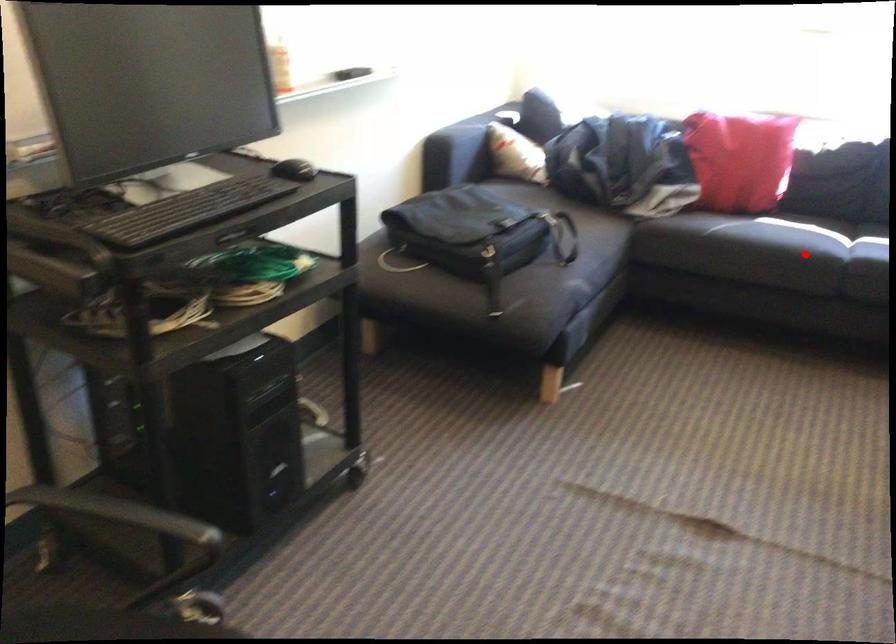
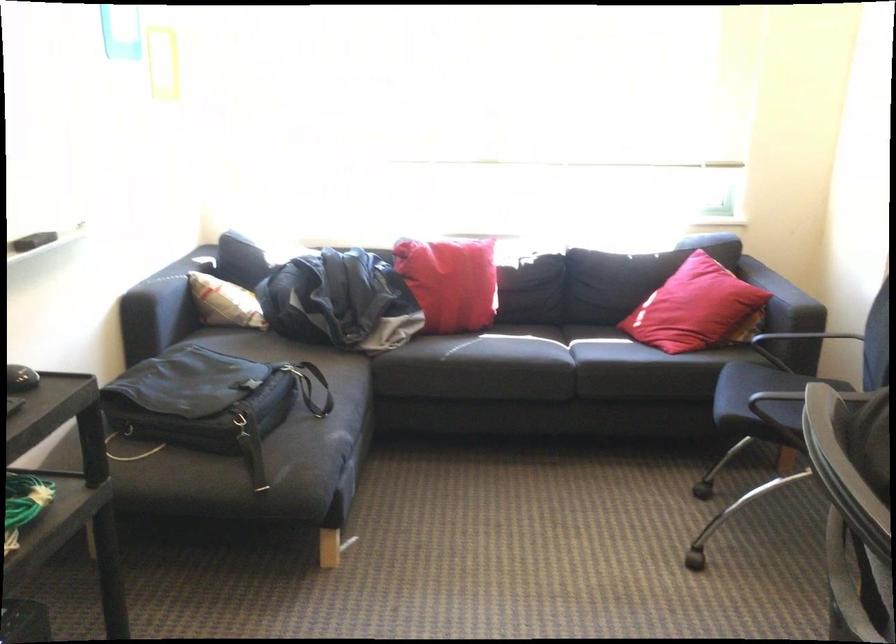
Locate, in the second image, the point that corresponds to the highlighted location in the first image.

(535, 364)